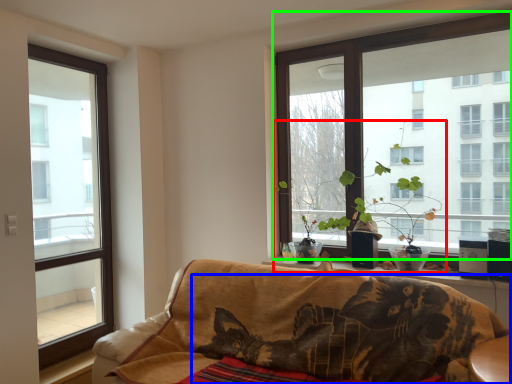
Question: Estimate the real-world distances between objects in this image. Which object is closer to houseplant (highlighted by a red box), cat (highlighted by a blue box) or window (highlighted by a green box)?

Choices:
 (A) cat
 (B) window

Answer: (B)